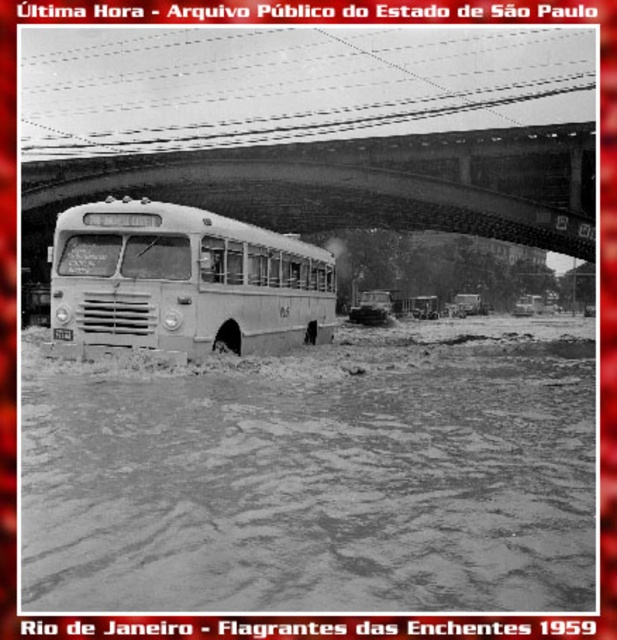
What is the exact coordinate of the muddy water at lower center in the image?

The muddy water at lower center is located at point (317,476).

Based on the scene description, can you determine if the muddy water at lower center is wider than the white matte school bus at center?

The muddy water at lower center might be wider than the white matte school bus at center according to the description.

Looking at this image, you are a rescue worker trying to reach a stranded person located at point (379, 182) in the flood scene. The rescue boat you have can only travel up to 30 meters. Can you safely reach them with your current boat?

The point (379, 182) is 29.35 meters away from the camera, so yes, the rescue boat can safely reach them since it is within the 30 meters travel limit.